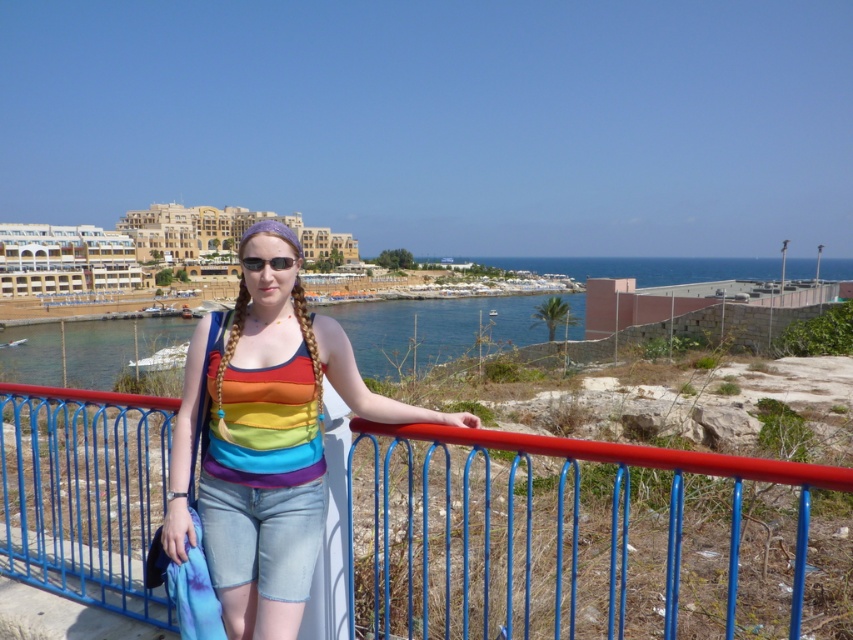
Question: Can you confirm if blue metal fence at center is smaller than black plastic sunglasses at center?

Choices:
 (A) no
 (B) yes

Answer: (A)

Question: Can you confirm if blue metal fence at center is wider than rainbow fabric tank top at center?

Choices:
 (A) yes
 (B) no

Answer: (A)

Question: Which object is the farthest from the rainbow fabric tank top at center?

Choices:
 (A) blue metal fence at center
 (B) black plastic sunglasses at center

Answer: (A)

Question: Can you confirm if blue metal fence at center is positioned to the right of rainbow fabric tank top at center?

Choices:
 (A) no
 (B) yes

Answer: (A)

Question: Estimate the real-world distances between objects in this image. Which object is closer to the black plastic sunglasses at center?

Choices:
 (A) blue metal fence at center
 (B) rainbow fabric tank top at center

Answer: (B)

Question: Which of the following is the farthest from the observer?

Choices:
 (A) (262, 264)
 (B) (466, 508)

Answer: (A)